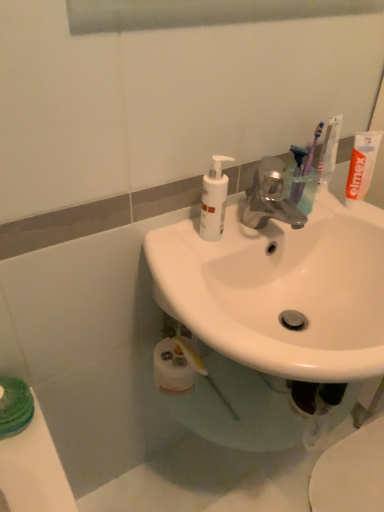
At what (x,y) coordinates should I click in order to perform the action: click on free point to the left of white matte pump bottle at upper center. Please return your answer as a coordinate pair (x, y). This screenshot has height=512, width=384. Looking at the image, I should click on (170, 240).